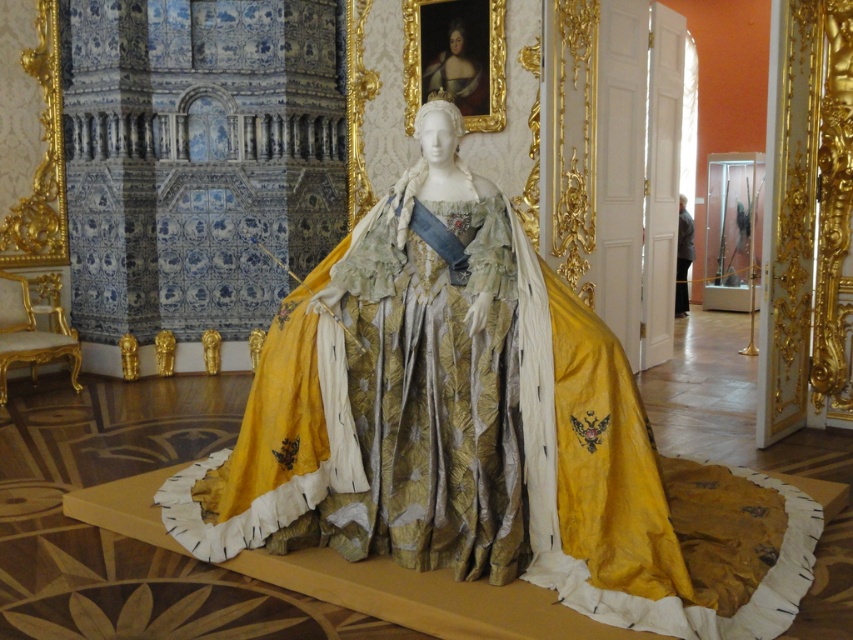
You are a museum curator arranging a display. You need to place a new plaque that will be positioned to the right of the gold satin gown at center. Based on the current arrangement, where should you place the plaque relative to the smooth gold crown at upper center?

The smooth gold crown at upper center is to the left of the gold satin gown at center. Therefore, placing the plaque to the right of the gold satin gown at center would mean it is to the right of the smooth gold crown at upper center as well.

You are standing in the museum and want to take a photo of the mannequin. The camera you have can only focus on objects within 5 meters. Is the point at coordinates point (467,97) close enough for the camera to focus?

The distance of point (467,97) from viewer is 7.22 meters, which is beyond the camera focus range of 5 meters. Therefore, the camera cannot focus on that point.

You are a photographer adjusting your camera settings in the museum. You want to focus on two points in the image, point (461,72) and point (683,308). Which point should you prioritize focusing on first to ensure it appears sharp in the photo?

Point (461,72) is closer to the camera than point (683,308), so you should prioritize focusing on point (461,72) first to ensure it appears sharp in the photo.